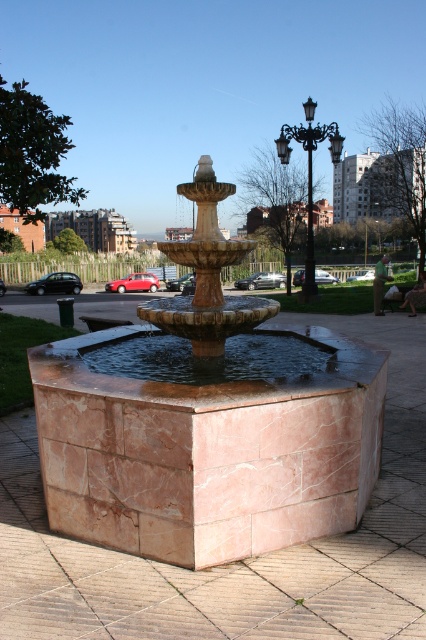
You are standing at the point with coordinates (201,305) in the park. What object is exactly at your current location?

The marble fountain at center is exactly at the point with coordinates (201,305).

You are standing in front of the fountain and want to place a small statue exactly halfway between point (264, 401) and point (311, 116). Which direction should you move from the closer point to reach the halfway point?

Since point (264, 401) is closer to the viewer than point (311, 116), you should move towards the direction of the farther point (311, 116) to reach the halfway point between them.